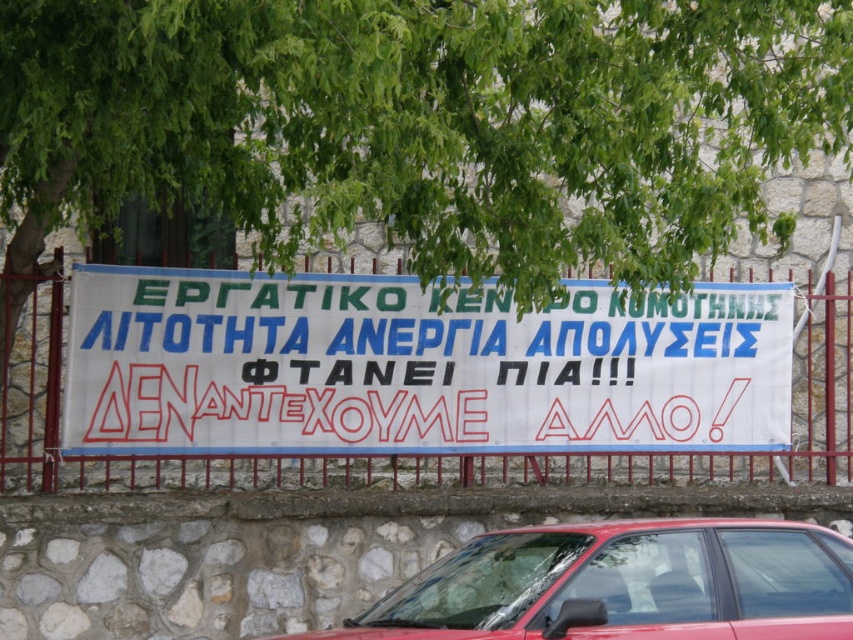
You are a photographer trying to capture both the white paper banner at center and the shiny red car at center in a single shot. Since the banner is taller than the car, which object will you need to adjust your camera angle to focus on first?

The white paper banner at center has a greater height compared to the shiny red car at center, so you will need to adjust your camera angle to focus on the white paper banner at center first due to its larger size.

You are a photographer trying to capture both the white paper banner at center and the shiny red car at center in the same frame. Based on their sizes, which object should you focus on first to ensure both fit in the frame?

The white paper banner at center has a larger width than the shiny red car at center, so you should focus on positioning the camera to include the wider banner first to ensure both objects fit in the frame.